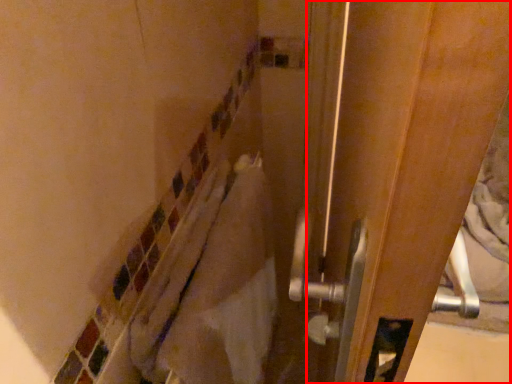
Question: In this image, where is screen door (annotated by the red box) located relative to material?

Choices:
 (A) right
 (B) left

Answer: (A)